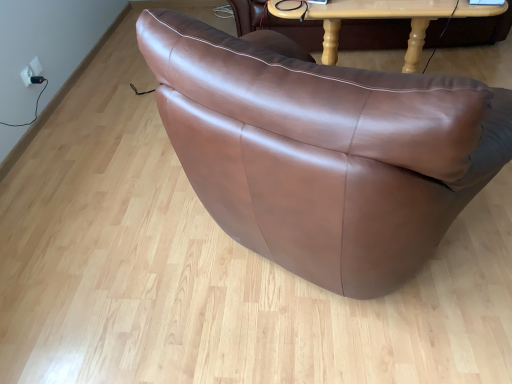
Question: Should I look upward or downward to see light brown wooden table at upper center?

Choices:
 (A) down
 (B) up

Answer: (B)

Question: Is light brown wooden table at upper center smaller than white plastic electric outlet at upper left?

Choices:
 (A) yes
 (B) no

Answer: (B)

Question: Is light brown wooden table at upper center thinner than white plastic electric outlet at upper left?

Choices:
 (A) no
 (B) yes

Answer: (A)

Question: Is light brown wooden table at upper center looking in the opposite direction of white plastic electric outlet at upper left?

Choices:
 (A) yes
 (B) no

Answer: (B)

Question: Can you confirm if light brown wooden table at upper center is positioned to the right of white plastic electric outlet at upper left?

Choices:
 (A) yes
 (B) no

Answer: (A)

Question: Is light brown wooden table at upper center closer to the viewer compared to white plastic electric outlet at upper left?

Choices:
 (A) no
 (B) yes

Answer: (B)

Question: Is light brown wooden table at upper center shorter than white plastic electric outlet at upper left?

Choices:
 (A) yes
 (B) no

Answer: (B)

Question: Is white plastic electric outlet at upper left turned away from light brown wooden table at upper center?

Choices:
 (A) no
 (B) yes

Answer: (A)

Question: Are white plastic electric outlet at upper left and light brown wooden table at upper center far apart?

Choices:
 (A) no
 (B) yes

Answer: (B)

Question: Is light brown wooden table at upper center completely or partially inside white plastic electric outlet at upper left?

Choices:
 (A) yes
 (B) no

Answer: (B)

Question: Considering the relative positions of white plastic electric outlet at upper left and light brown wooden table at upper center in the image provided, is white plastic electric outlet at upper left to the right of light brown wooden table at upper center from the viewer's perspective?

Choices:
 (A) no
 (B) yes

Answer: (A)

Question: From the image's perspective, is white plastic electric outlet at upper left on light brown wooden table at upper center?

Choices:
 (A) yes
 (B) no

Answer: (B)

Question: Is white plastic electric outlet at upper left positioned behind light brown wooden table at upper center?

Choices:
 (A) yes
 (B) no

Answer: (A)

Question: In terms of width, does light brown wooden table at upper center look wider or thinner when compared to white plastic electric outlet at upper left?

Choices:
 (A) thin
 (B) wide

Answer: (B)